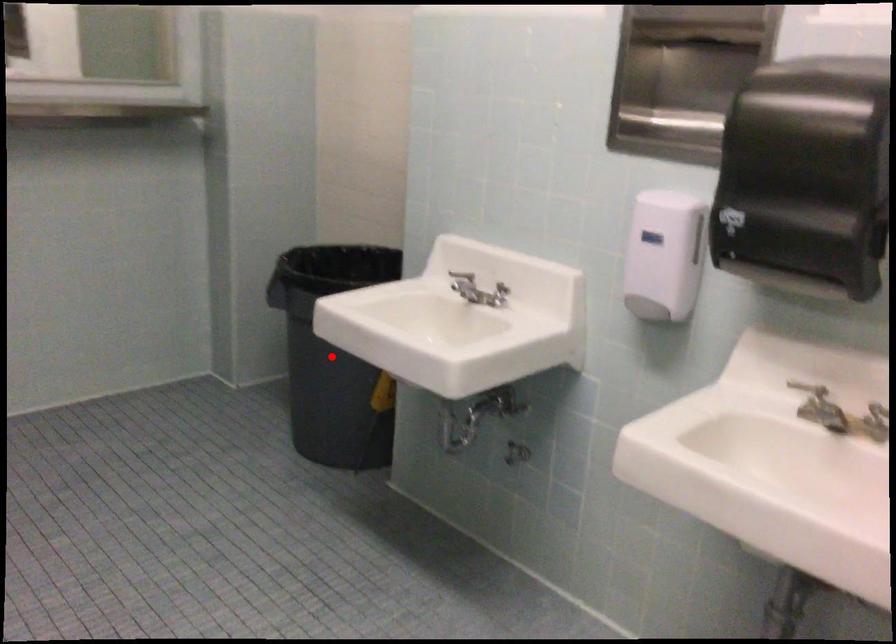
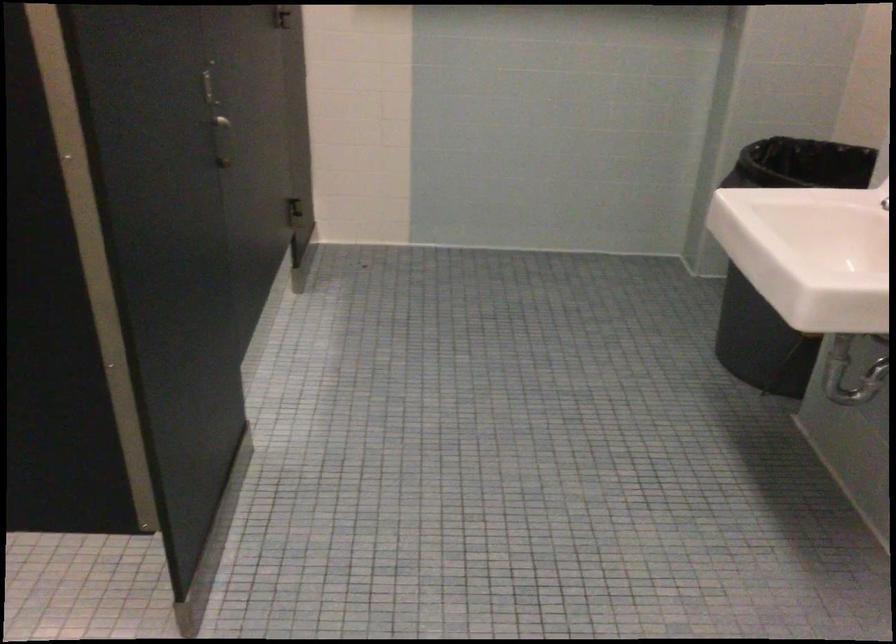
Question: I am providing you with two images of the same scene from different viewpoints. A red point is marked on the first image. At the location where the point appears in image 1, is it still visible in image 2?

Choices:
 (A) Yes
 (B) No

Answer: (B)